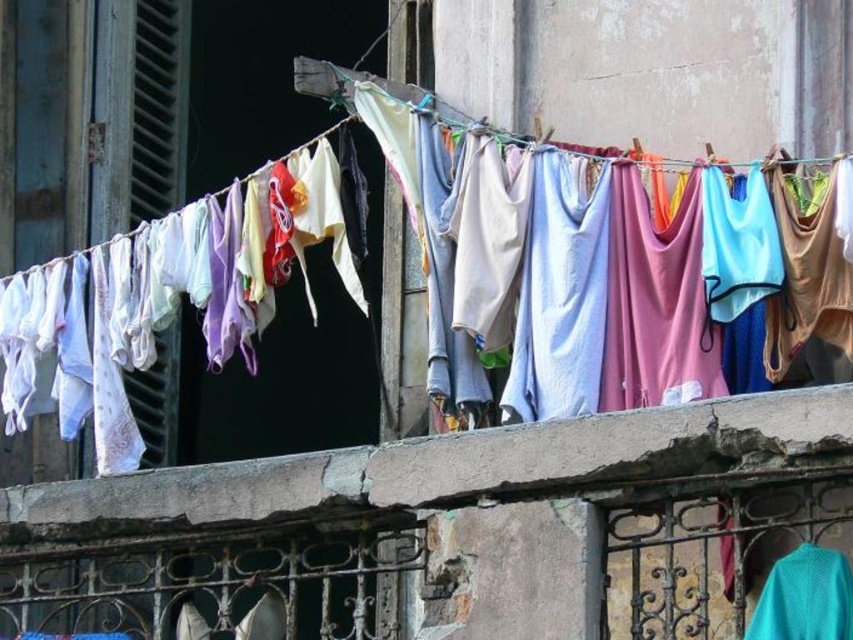
Question: Does concrete at center appear on the right side of white cotton towel at center?

Choices:
 (A) yes
 (B) no

Answer: (B)

Question: Can you confirm if concrete at center is positioned above white cotton towel at center?

Choices:
 (A) no
 (B) yes

Answer: (A)

Question: Which of the following is the closest to the observer?

Choices:
 (A) (683, 611)
 (B) (132, 236)

Answer: (A)

Question: Is concrete at center positioned at the back of white cotton towel at center?

Choices:
 (A) no
 (B) yes

Answer: (A)

Question: Which point is farther to the camera?

Choices:
 (A) concrete at center
 (B) white cotton towel at center

Answer: (B)